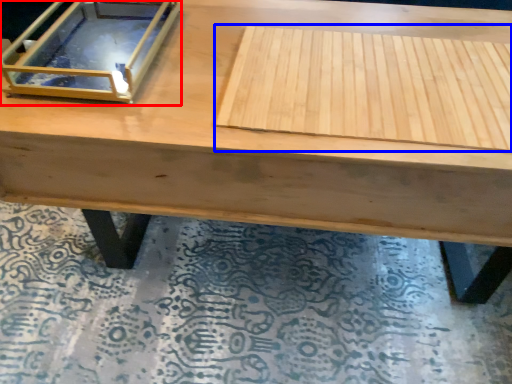
Question: Which point is closer to the camera, glass box (highlighted by a red box) or plywood (highlighted by a blue box)?

Choices:
 (A) glass box
 (B) plywood

Answer: (B)